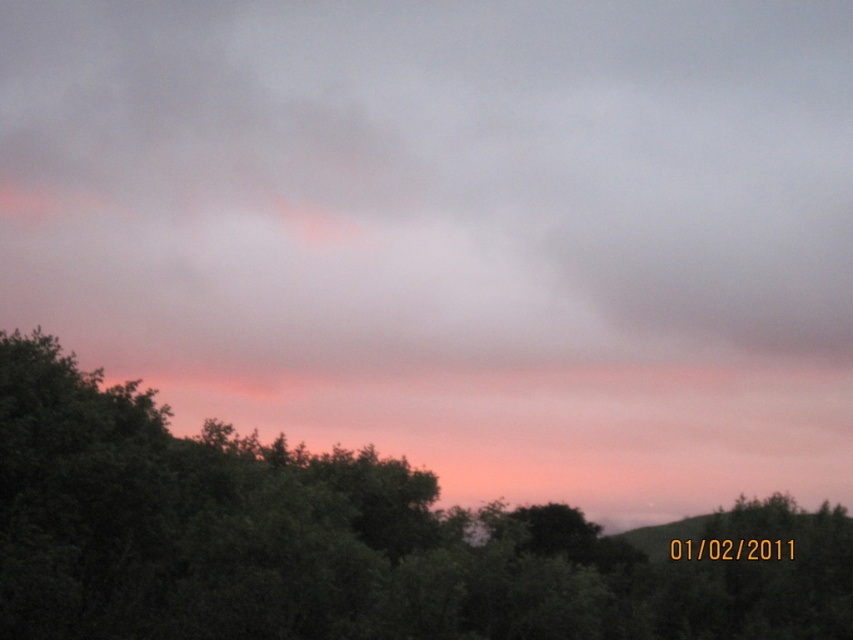
Which is more to the left, pink translucent cloud at upper center or green leafy tree at lower left?

Positioned to the left is pink translucent cloud at upper center.

Between point (532, 60) and point (572, 632), which one is positioned in front?

Point (572, 632) is more forward.

Is point (440, 262) positioned in front of point (564, 531)?

No, (440, 262) is further to viewer.

Locate an element on the screen. Image resolution: width=853 pixels, height=640 pixels. pink translucent cloud at upper center is located at coordinates (431, 173).